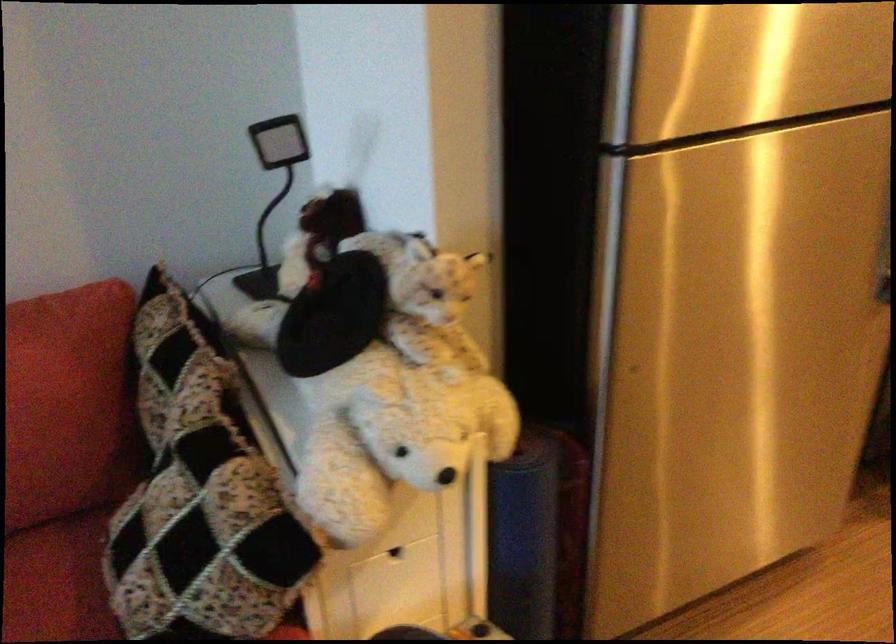
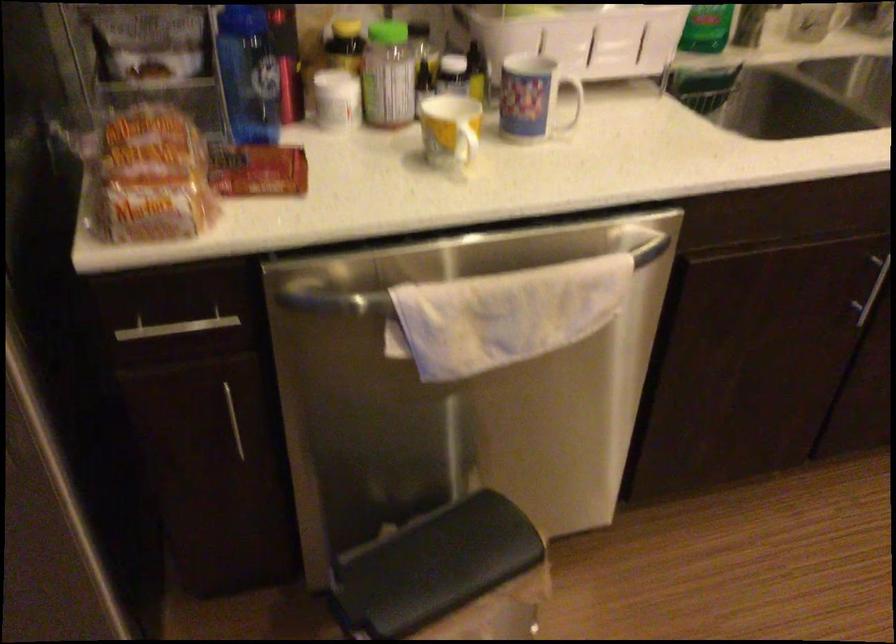
What movement of the cameraman would produce the second image?

The cameraman moved toward right, forward.